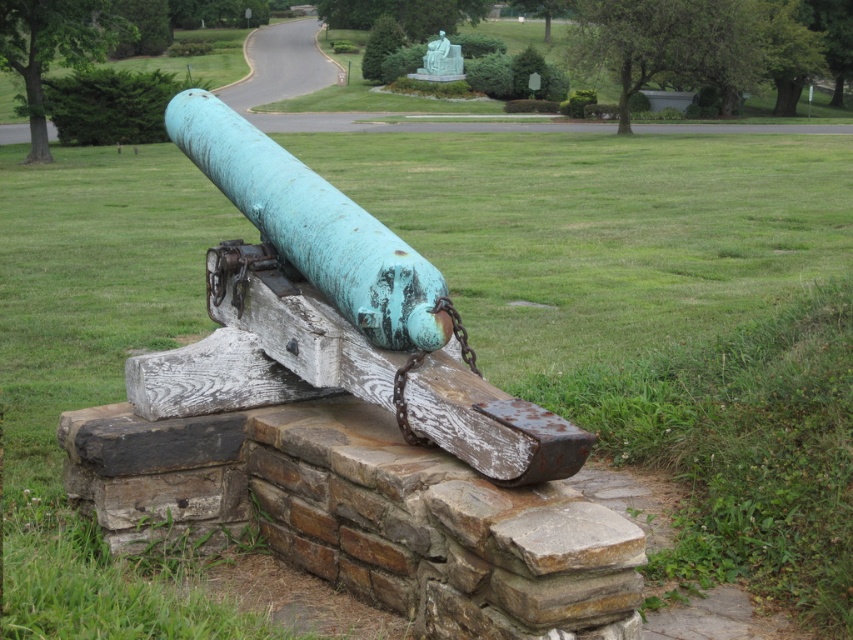
Between point (310, 195) and point (305, 232), which one is positioned behind?

Positioned behind is point (310, 195).

Is green patina metal cannon at center further to camera compared to rusty wood log at center?

That is False.

This screenshot has height=640, width=853. I want to click on green patina metal cannon at center, so click(x=354, y=304).